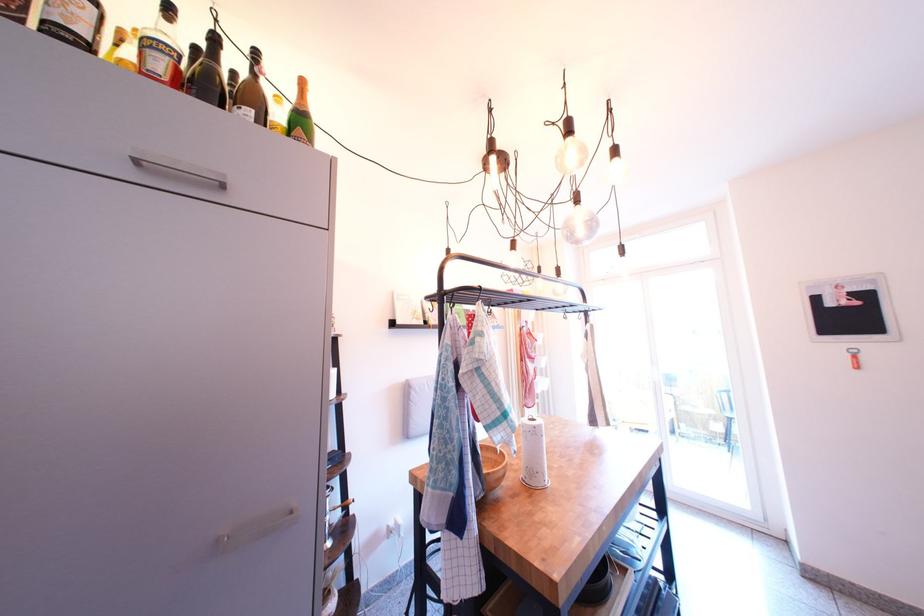
Which object does [407,310] point to?

It corresponds to the small white book in the image.